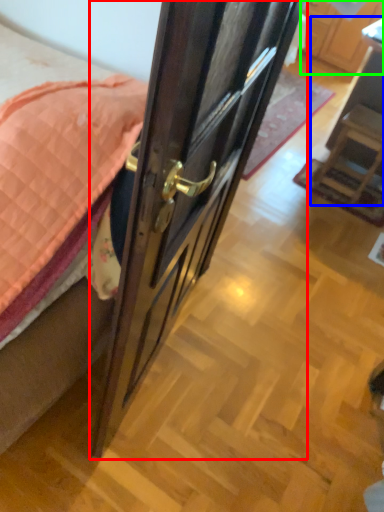
Question: Based on their relative distances, which object is farther from door (highlighted by a red box)? Choose from furniture (highlighted by a blue box) and cabinetry (highlighted by a green box).

Choices:
 (A) furniture
 (B) cabinetry

Answer: (B)